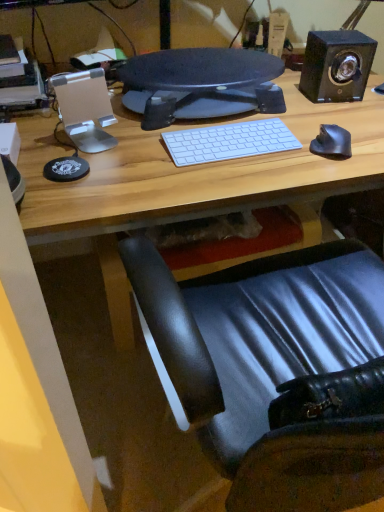
Identify the location of vacant area situated to the left side of white matte keyboard at center. (133, 152).